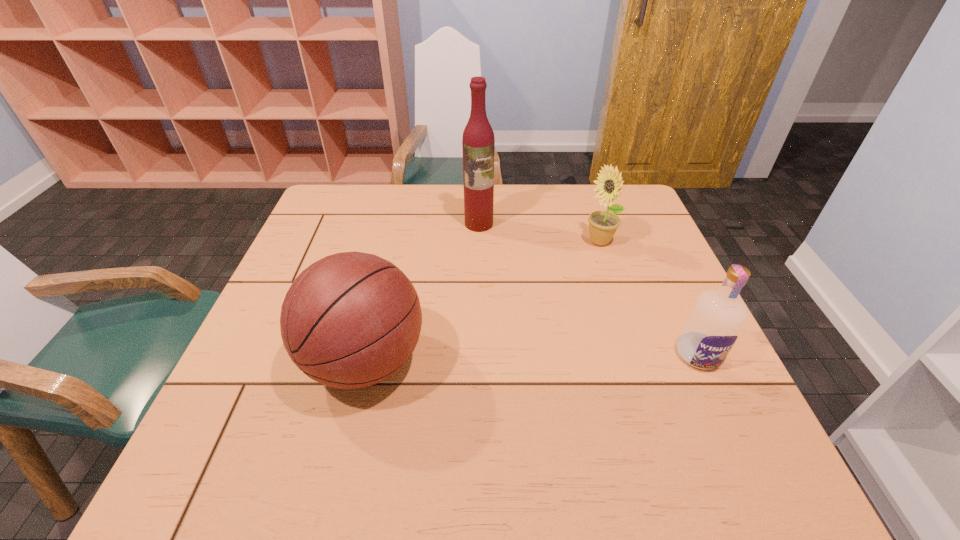
This screenshot has width=960, height=540. In order to click on vacant area that lies between the farthest object and the rightmost object in this screenshot , I will do `click(588, 289)`.

Find the location of `vacant space that is in between the basketball and the vodka`. vacant space that is in between the basketball and the vodka is located at coordinates (532, 358).

This screenshot has height=540, width=960. What are the coordinates of `vacant space that's between the second farthest object and the leftmost object` in the screenshot? It's located at (483, 302).

You are a GUI agent. You are given a task and a screenshot of the screen. Output one action in this format:
    pyautogui.click(x=<x>, y=<y>)
    Task: Click on the free spot between the basketball and the rightmost object
    Image resolution: width=960 pixels, height=540 pixels.
    Given the screenshot: What is the action you would take?
    pyautogui.click(x=532, y=358)

The image size is (960, 540). In order to click on vacant space that's between the leftmost object and the rightmost object in this screenshot , I will do `click(532, 358)`.

Locate which object ranks in proximity to the third object from right to left. Please provide its 2D coordinates. Your answer should be formatted as a tuple, i.e. [(x, y)], where the tuple contains the x and y coordinates of a point satisfying the conditions above.

[(602, 224)]

Where is `object that is the second closest to the third object from right to left`? Image resolution: width=960 pixels, height=540 pixels. object that is the second closest to the third object from right to left is located at coordinates (350, 320).

Where is `free space that satisfies the following two spatial constraints: 1. on the back side of the leftmost object; 2. on the right side of the tallest object`? The image size is (960, 540). free space that satisfies the following two spatial constraints: 1. on the back side of the leftmost object; 2. on the right side of the tallest object is located at coordinates (398, 224).